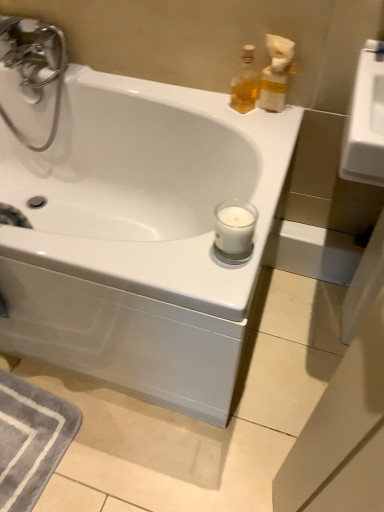
Question: Is point (263, 245) closer or farther from the camera than point (264, 94)?

Choices:
 (A) farther
 (B) closer

Answer: (B)

Question: Is white glossy bathtub at center to the left or to the right of translucent plastic soap dispenser at upper right, the 1th soap dispenser when ordered from right to left, in the image?

Choices:
 (A) left
 (B) right

Answer: (A)

Question: Estimate the real-world distances between objects in this image. Which object is closer to the translucent glass bottle at upper right, placed as the 2th soap dispenser when sorted from right to left?

Choices:
 (A) white glossy bathtub at center
 (B) translucent plastic soap dispenser at upper right, the 1th soap dispenser when ordered from right to left

Answer: (B)

Question: Considering the real-world distances, which object is farthest from the translucent plastic soap dispenser at upper right, the 1th soap dispenser when ordered from right to left?

Choices:
 (A) translucent glass bottle at upper right, the first soap dispenser in the left-to-right sequence
 (B) white glossy bathtub at center

Answer: (B)